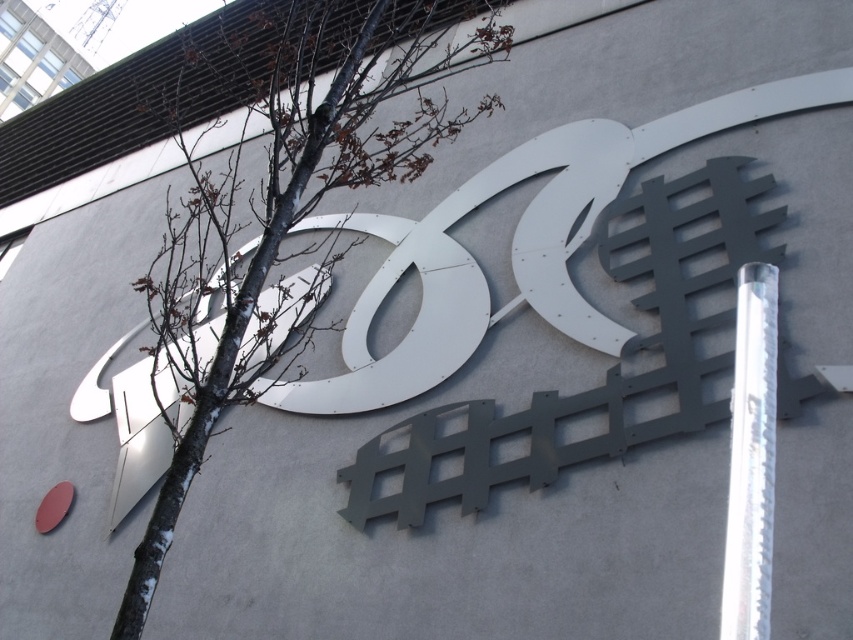
You are a maintenance worker needing to place a 9 feet long ladder between the bare wood tree at center and the silver metallic pole at right. Can the ladder fit horizontally between them?

The distance between the bare wood tree at center and the silver metallic pole at right is 8.90 feet. Since the ladder is 9 feet long, it is slightly too long to fit horizontally between them.

Based on the photo, you are standing in front of a building with a large logo. There is a bare wood tree at center in the scene. If you want to take a photo of the logo without the tree blocking it, where should you move relative to the current position?

The bare wood tree at center is located at point (x=314, y=192). To avoid the tree blocking the logo, move to the right or left of the tree to ensure it is out of the frame.

You are standing in front of the building facade. You notice a bare wood tree at center and a silver metallic pole at right. Which object is wider in terms of their base width?

→ The bare wood tree at center might be wider than silver metallic pole at right according to the description.